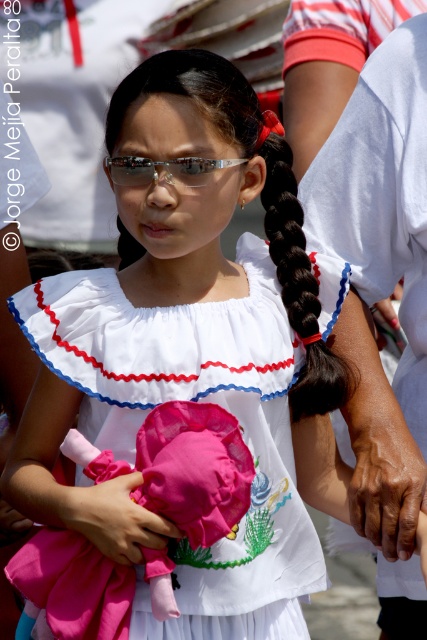
Describe the element at coordinates (297, 278) in the screenshot. Image resolution: width=427 pixels, height=640 pixels. I see `black silky hair at center` at that location.

Is black silky hair at center closer to the viewer compared to dry skin at lower right?

Yes, it is in front of dry skin at lower right.

Is point (263, 188) farther from camera compared to point (353, 428)?

No, (263, 188) is closer to viewer.

At what (x,y) coordinates should I click in order to perform the action: click on black silky hair at center. Please return your answer as a coordinate pair (x, y). The width and height of the screenshot is (427, 640). Looking at the image, I should click on pos(297,278).

Does dry skin at lower right lie in front of shiny metallic sunglasses at center?

No.

What do you see at coordinates (386, 480) in the screenshot? I see `dry skin at lower right` at bounding box center [386, 480].

Does point (388, 522) lie behind point (132, 157)?

Yes, point (388, 522) is behind point (132, 157).

This screenshot has width=427, height=640. In order to click on dry skin at lower right in this screenshot , I will do `click(386, 480)`.

At what (x,y) coordinates should I click in order to perform the action: click on white cotton dress at center. Please return your answer as a coordinate pair (x, y). The height and width of the screenshot is (640, 427). Looking at the image, I should click on (198, 401).

I want to click on white cotton dress at center, so click(198, 401).

The height and width of the screenshot is (640, 427). I want to click on white cotton dress at center, so click(198, 401).